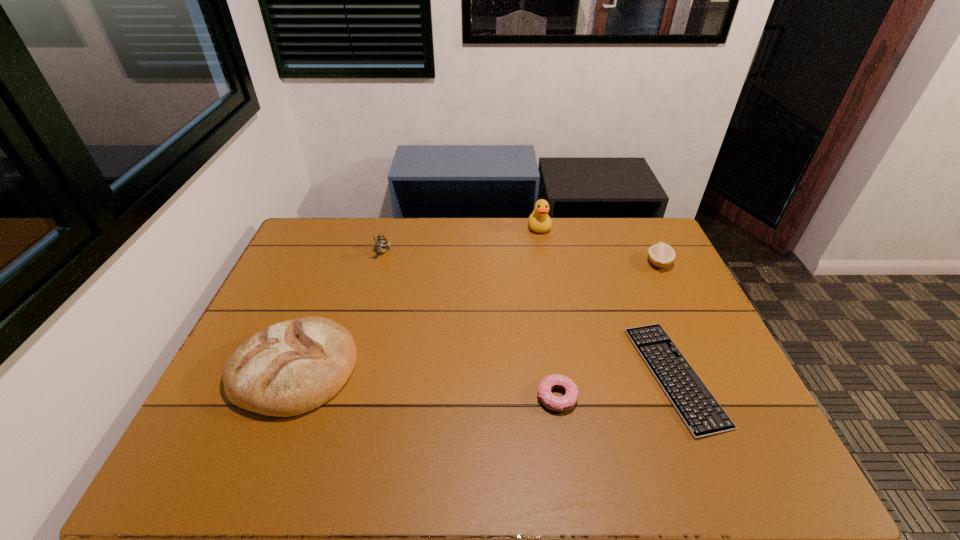
The height and width of the screenshot is (540, 960). Identify the location of free spot at the far edge of the desktop. (441, 221).

Find the location of `vacant area at the near edge of the desktop`. vacant area at the near edge of the desktop is located at coordinates (571, 464).

At what (x,y) coordinates should I click in order to perform the action: click on free spot at the left edge of the desktop. Please return your answer as a coordinate pair (x, y). Image resolution: width=960 pixels, height=540 pixels. Looking at the image, I should click on (318, 284).

In the image, there is a desktop. Find the location of `free space at the right edge`. free space at the right edge is located at coordinates (724, 377).

The height and width of the screenshot is (540, 960). Find the location of `blank space at the far left corner of the desktop`. blank space at the far left corner of the desktop is located at coordinates pyautogui.click(x=343, y=233).

Locate an element on the screen. The width and height of the screenshot is (960, 540). free space at the far right corner is located at coordinates (645, 237).

Where is `vacant area that lies between the third shortest object and the bread`? This screenshot has height=540, width=960. vacant area that lies between the third shortest object and the bread is located at coordinates (476, 315).

In order to click on free space between the snail and the fourth tallest object in this screenshot , I will do `click(520, 258)`.

In order to click on free spot between the tallest object and the bread in this screenshot , I will do `click(417, 298)`.

This screenshot has width=960, height=540. Identify the location of unoccupied area between the duck and the third shortest object. (599, 245).